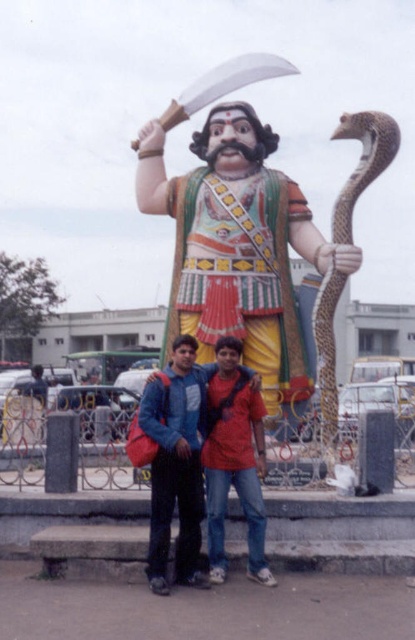
Question: Which point is farther to the camera?

Choices:
 (A) (165, 449)
 (B) (358, 170)
 (C) (266, 204)

Answer: (C)

Question: Which point is closer to the camera taking this photo?

Choices:
 (A) (249, 132)
 (B) (231, 365)
 (C) (395, 154)

Answer: (B)

Question: Can you confirm if polished bronze statue at center is wider than denim jacket at center?

Choices:
 (A) no
 (B) yes

Answer: (B)

Question: Is polished bronze statue at center thinner than denim jacket at center?

Choices:
 (A) no
 (B) yes

Answer: (A)

Question: Can you confirm if polished bronze statue at center is thinner than leather-like brown snake at right?

Choices:
 (A) yes
 (B) no

Answer: (B)

Question: Which point is farther from the camera taking this photo?

Choices:
 (A) (358, 115)
 (B) (268, 141)
 (C) (178, 451)

Answer: (B)